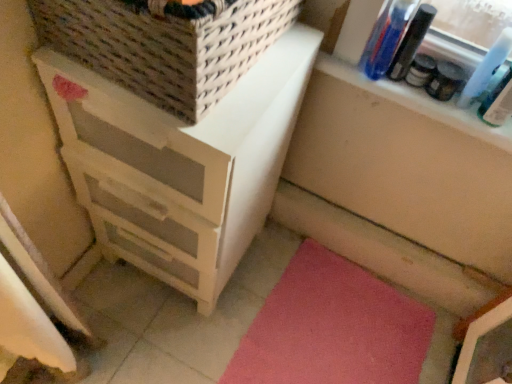
You are a GUI agent. You are given a task and a screenshot of the screen. Output one action in this format:
    pyautogui.click(x=<x>, y=<y>)
    Task: Click on the vacant space that's between white wood chest of drawers at left and pink carpet at lower right
    The image size is (512, 384).
    Given the screenshot: What is the action you would take?
    pyautogui.click(x=219, y=300)